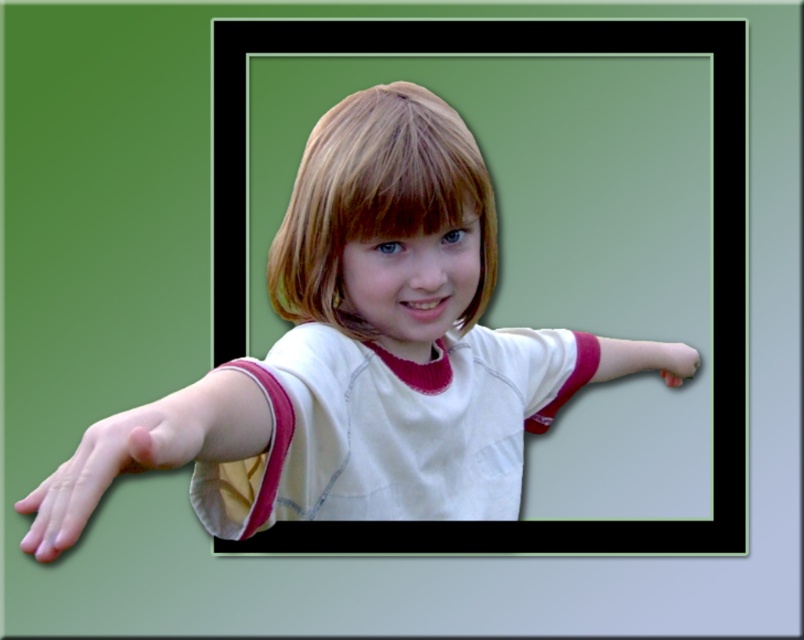
You are a photographer adjusting the lighting for a photo shoot with a child. You notice the pink fabric arm at lower left and the smooth skin hand at lower left in the frame. Which object should you focus your light on to ensure it stands out more due to its size?

The pink fabric arm at lower left has a greater height compared to the smooth skin hand at lower left, so you should focus the light on the pink fabric arm at lower left to highlight its larger size.

Based on the scene description, which object is taller between the blonde smooth hair at center and the white fabric arm at center?

The blonde smooth hair at center is taller than the white fabric arm at center according to the description.

You are an artist trying to digitally paint the scene shown. You need to place a highlight on the pink fabric arm at lower left. According to the image coordinates, where should you place it?

The pink fabric arm at lower left is located at coordinates point (x=146, y=451), so you should place the highlight there.